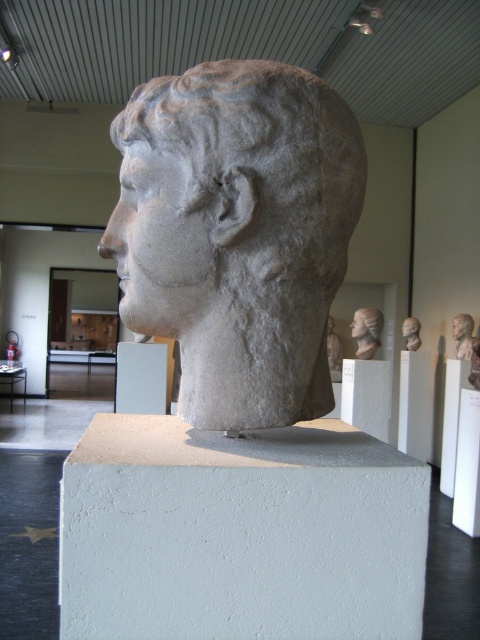
Question: Is white matte pillar at center below white stone pillar at center?

Choices:
 (A) yes
 (B) no

Answer: (B)

Question: Is gray stone head at center behind matte stone bust at center?

Choices:
 (A) yes
 (B) no

Answer: (B)

Question: Which object appears farthest from the camera in this image?

Choices:
 (A) gray stone head at center
 (B) white marble head at center
 (C) white stone pillar at center

Answer: (C)

Question: Which is farther from the white stone head at center?

Choices:
 (A) matte stone bust at center
 (B) white marble head at center

Answer: (B)

Question: In this image, where is white marble head at center located relative to matte stone bust at center?

Choices:
 (A) left
 (B) right

Answer: (A)

Question: Among these points, which one is farthest from the camera?

Choices:
 (A) pos(372,388)
 (B) pos(308,372)
 (C) pos(407,339)
 (D) pos(425,433)

Answer: (C)